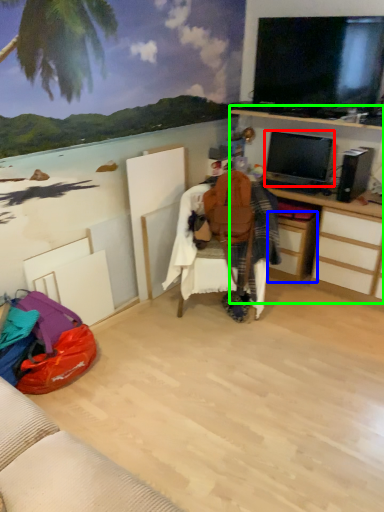
Question: Which object is positioned closest to television (highlighted by a red box)? Select from drawer (highlighted by a blue box) and computer desk (highlighted by a green box).

Choices:
 (A) drawer
 (B) computer desk

Answer: (B)